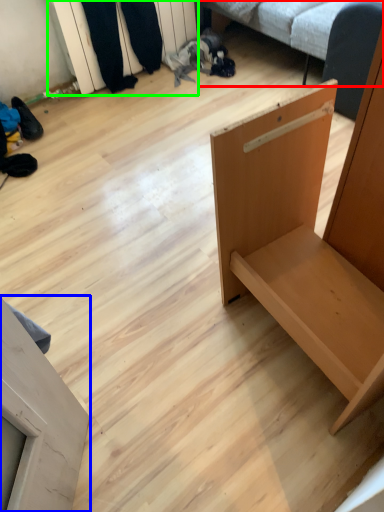
Question: Based on their relative distances, which object is farther from studio couch (highlighted by a red box)? Choose from furniture (highlighted by a blue box) and shelf (highlighted by a green box).

Choices:
 (A) furniture
 (B) shelf

Answer: (A)